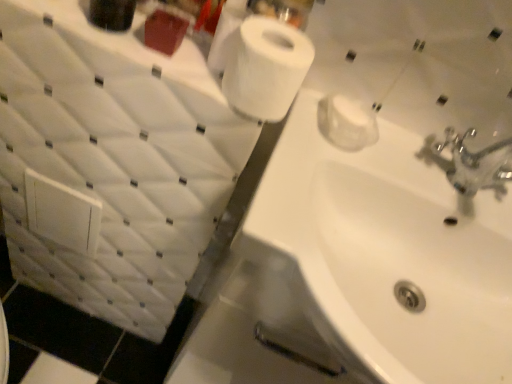
Question: Does point (269, 107) appear closer or farther from the camera than point (465, 268)?

Choices:
 (A) closer
 (B) farther

Answer: (A)

Question: Which is correct: white matte toilet paper at upper center is inside white glossy sink at center, or outside of it?

Choices:
 (A) inside
 (B) outside

Answer: (B)

Question: From a real-world perspective, relative to white glossy sink at center, is white matte toilet paper at upper center vertically above or below?

Choices:
 (A) above
 (B) below

Answer: (A)

Question: Considering the positions of white glossy sink at center and white matte toilet paper at upper center in the image, is white glossy sink at center taller or shorter than white matte toilet paper at upper center?

Choices:
 (A) tall
 (B) short

Answer: (A)

Question: From a real-world perspective, is white glossy sink at center above or below white matte toilet paper at upper center?

Choices:
 (A) above
 (B) below

Answer: (B)

Question: Relative to white matte toilet paper at upper center, is white glossy sink at center in front or behind?

Choices:
 (A) behind
 (B) front

Answer: (A)

Question: In terms of size, does white glossy sink at center appear bigger or smaller than white matte toilet paper at upper center?

Choices:
 (A) small
 (B) big

Answer: (B)